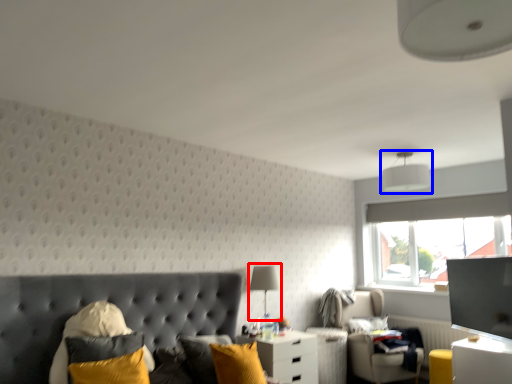
Question: Which object is further to the camera taking this photo, table lamp (highlighted by a red box) or lamp (highlighted by a blue box)?

Choices:
 (A) table lamp
 (B) lamp

Answer: (B)